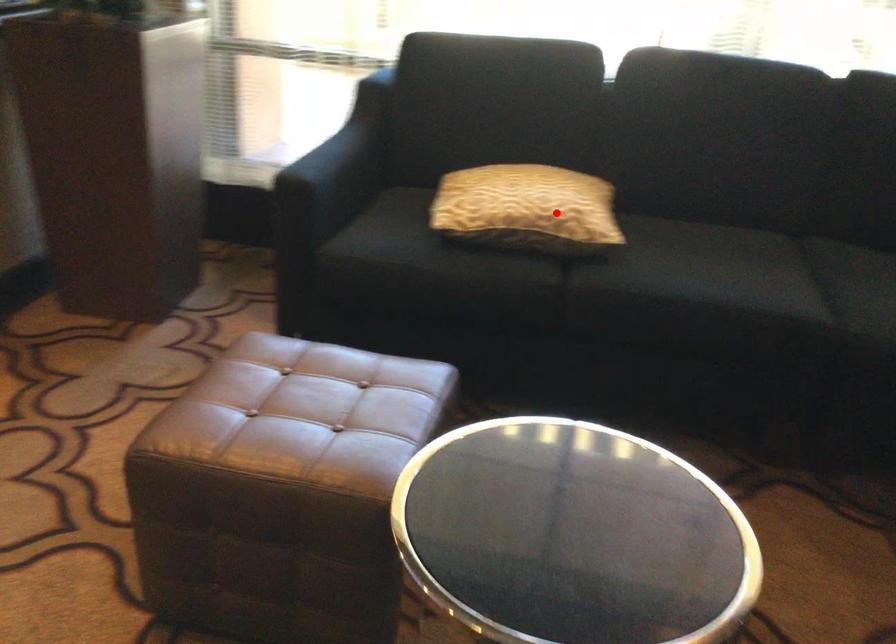
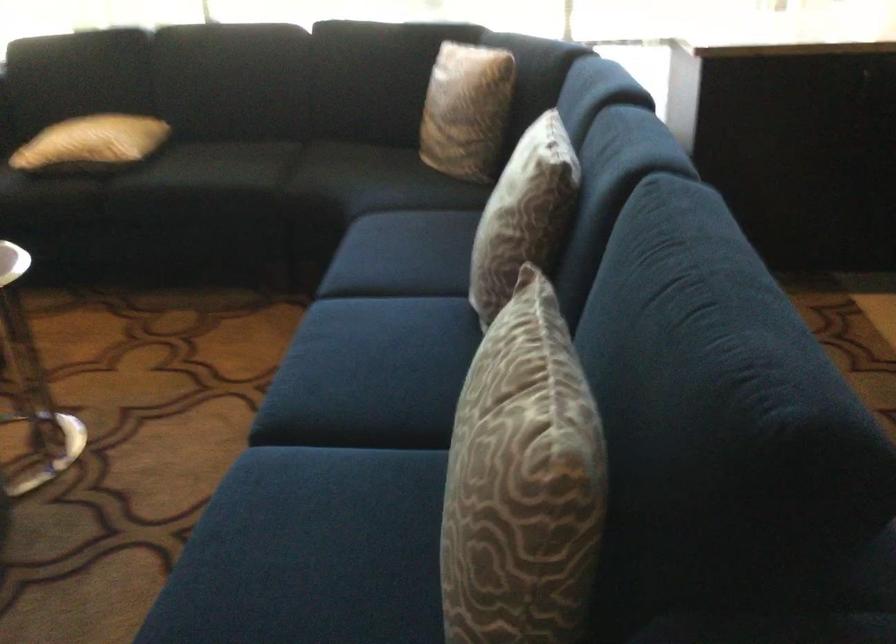
The point at the highlighted location is marked in the first image. Where is the corresponding point in the second image?

(91, 142)